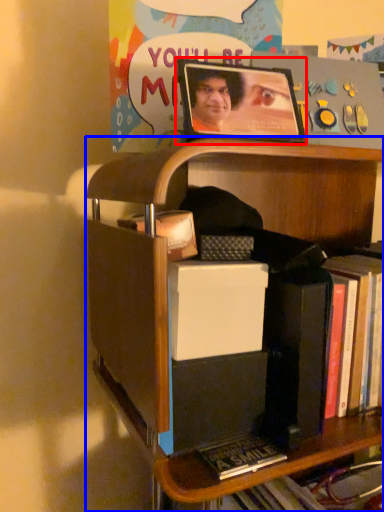
Question: Among these objects, which one is nearest to the camera, picture frame (highlighted by a red box) or shelf (highlighted by a blue box)?

Choices:
 (A) picture frame
 (B) shelf

Answer: (B)